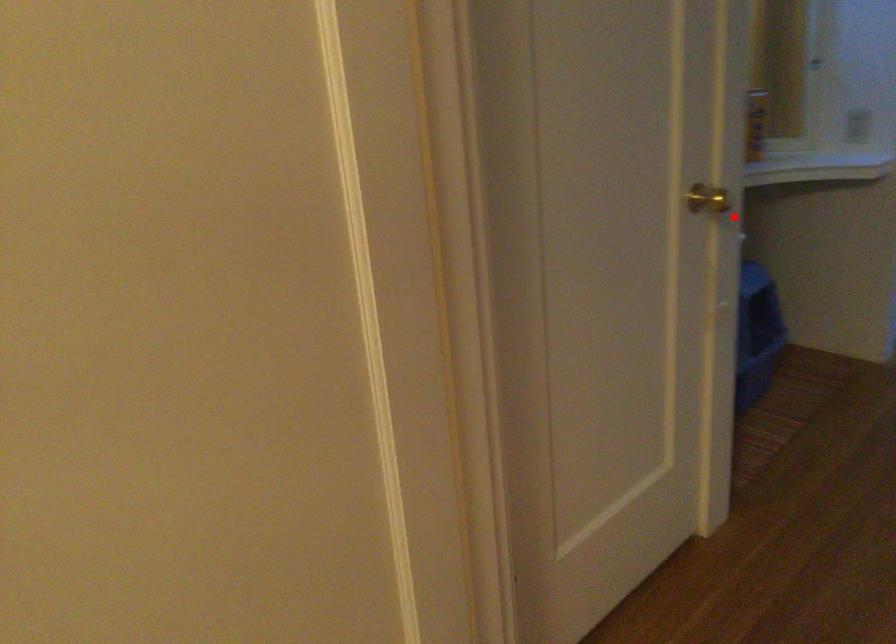
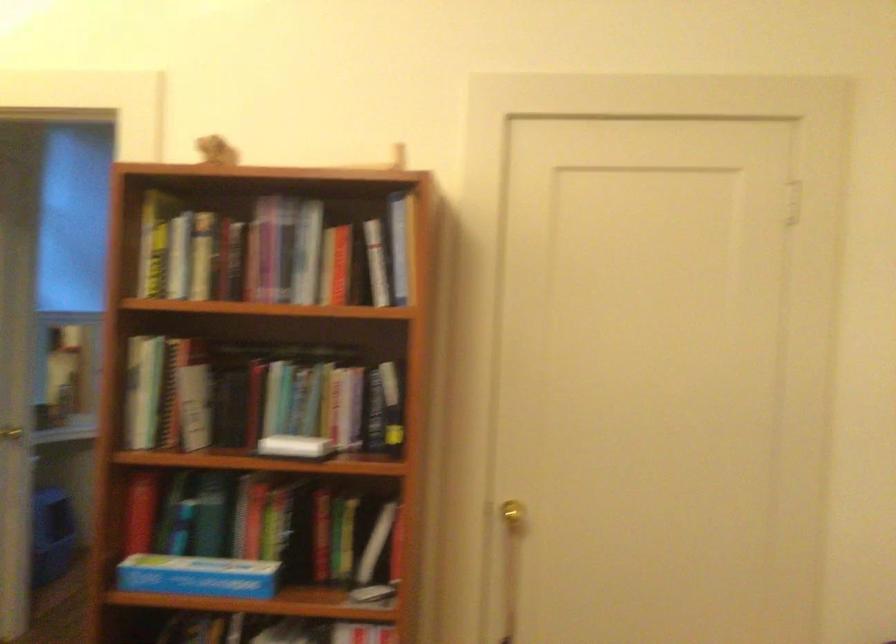
The point at the highlighted location is marked in the first image. Where is the corresponding point in the second image?

(11, 433)